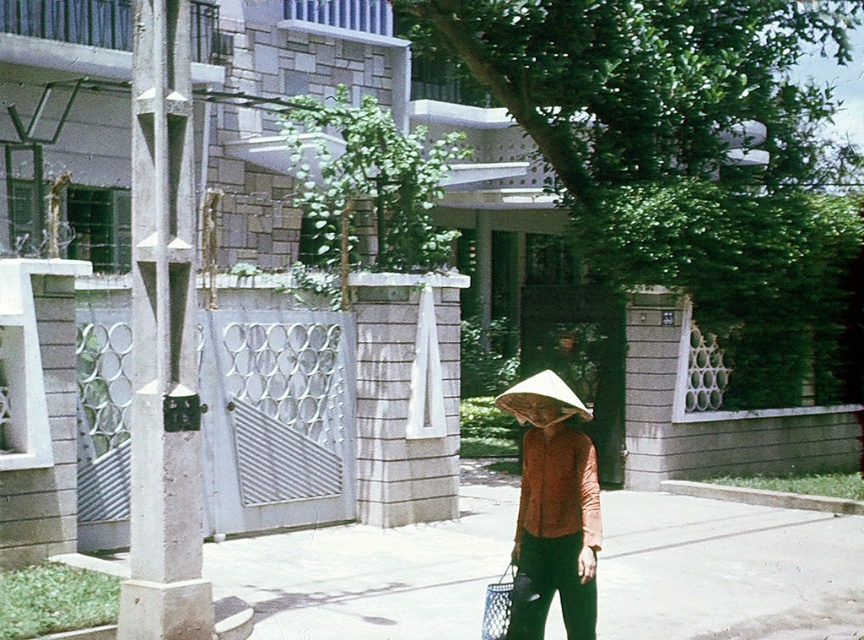
Which is more to the right, matte brown conical hat at center or white straw hat at center?

Positioned to the right is white straw hat at center.

Is matte brown conical hat at center smaller than white straw hat at center?

Yes.

Does point (543, 452) lie in front of point (524, 416)?

That is False.

At what (x,y) coordinates should I click in order to perform the action: click on matte brown conical hat at center. Please return your answer as a coordinate pair (x, y). Image resolution: width=864 pixels, height=640 pixels. Looking at the image, I should click on (553, 509).

Looking at this image, does smooth concrete pavement at center appear under white straw hat at center?

Indeed, smooth concrete pavement at center is positioned under white straw hat at center.

Which is below, smooth concrete pavement at center or white straw hat at center?

smooth concrete pavement at center

Locate an element on the screen. The height and width of the screenshot is (640, 864). smooth concrete pavement at center is located at coordinates (725, 568).

Is point (421, 612) closer to camera compared to point (561, 548)?

That is False.

Is point (687, 609) more distant than point (594, 456)?

Yes, it is.

Find the location of a particular element. smooth concrete pavement at center is located at coordinates (725, 568).